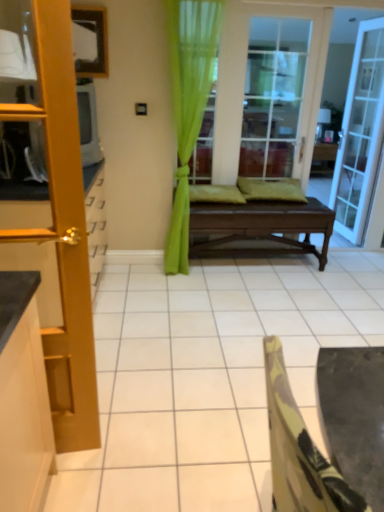
Identify the location of wooden door at left, which is the second door in right-to-left order. (63, 232).

What do you see at coordinates (258, 229) in the screenshot? The image size is (384, 512). I see `dark brown wooden bench at center` at bounding box center [258, 229].

The height and width of the screenshot is (512, 384). In order to click on green sheer curtain at center in this screenshot , I will do `click(188, 105)`.

In the image, there is a clear glass door at center. Where is `chair below it (from a real-world perspective)`? The image size is (384, 512). chair below it (from a real-world perspective) is located at coordinates (299, 451).

Which of these two, camouflage fabric chair at lower right or clear glass door at center, is thinner?

With smaller width is clear glass door at center.

Between camouflage fabric chair at lower right and clear glass door at center, which one has less height?

camouflage fabric chair at lower right is shorter.

I want to click on table located underneath the green sheer curtain at center (from a real-world perspective), so click(258, 229).

Is dark brown wooden bench at center facing away from green sheer curtain at center?

dark brown wooden bench at center is not turned away from green sheer curtain at center.

Could green sheer curtain at center be considered to be inside dark brown wooden bench at center?

No.

From the image's perspective, is dark brown wooden bench at center above or below green sheer curtain at center?

From the image's perspective, dark brown wooden bench at center appears below green sheer curtain at center.

Is clear glass door at center next to camouflage fabric chair at lower right and touching it?

No, clear glass door at center is not with camouflage fabric chair at lower right.

I want to click on glass door that appears behind the camouflage fabric chair at lower right, so click(273, 95).

From the image's perspective, which is above, clear glass door at center or camouflage fabric chair at lower right?

clear glass door at center appears higher in the image.

Looking at this image, can you confirm if dark brown wooden bench at center is taller than camouflage fabric chair at lower right?

No, dark brown wooden bench at center is not taller than camouflage fabric chair at lower right.

Would you say camouflage fabric chair at lower right is part of dark brown wooden bench at center's contents?

Actually, camouflage fabric chair at lower right is outside dark brown wooden bench at center.

Considering the points (218, 248) and (291, 462), which point is in front, point (218, 248) or point (291, 462)?

Point (291, 462)

Identify the location of chair lying in front of the dark brown wooden bench at center. This screenshot has width=384, height=512. point(299,451).

Between point (50, 378) and point (309, 436), which one is positioned in front?

Point (309, 436)

Between wooden door at left, the 1th door in the front-to-back sequence, and camouflage fabric chair at lower right, which one has larger width?

Wider between the two is camouflage fabric chair at lower right.

Could you tell me if wooden door at left, arranged as the second door when viewed from the back, is facing camouflage fabric chair at lower right?

No, wooden door at left, arranged as the second door when viewed from the back, is not turned towards camouflage fabric chair at lower right.

Can you confirm if wooden door at left, the 1th door in the left-to-right sequence, is smaller than camouflage fabric chair at lower right?

Yes, wooden door at left, the 1th door in the left-to-right sequence, is smaller than camouflage fabric chair at lower right.

Measure the distance between clear glass door at center and green sheer curtain at center.

A distance of 32.04 inches exists between clear glass door at center and green sheer curtain at center.

Is clear glass door at center not within green sheer curtain at center?

Indeed, clear glass door at center is completely outside green sheer curtain at center.

Is clear glass door at center not close to green sheer curtain at center?

No, clear glass door at center is not far away from green sheer curtain at center.

Considering the sizes of clear glass door at center and green sheer curtain at center in the image, is clear glass door at center wider or thinner than green sheer curtain at center?

Considering their sizes, clear glass door at center looks slimmer than green sheer curtain at center.

Locate an element on the screen. door located above the dark brown wooden bench at center (from the image's perspective) is located at coordinates (360, 133).

Which object is thinner, clear glass door at upper right, the 2th door from the left, or dark brown wooden bench at center?

Thinner between the two is clear glass door at upper right, the 2th door from the left.

Considering the relative positions of clear glass door at upper right, the 2th door positioned from the front, and dark brown wooden bench at center in the image provided, is clear glass door at upper right, the 2th door positioned from the front, to the left of dark brown wooden bench at center from the viewer's perspective?

In fact, clear glass door at upper right, the 2th door positioned from the front, is to the right of dark brown wooden bench at center.

How much distance is there between clear glass door at upper right, the 2th door from the left, and dark brown wooden bench at center?

clear glass door at upper right, the 2th door from the left, and dark brown wooden bench at center are 1.09 meters apart from each other.

This screenshot has width=384, height=512. What are the coordinates of `chair lying below the clear glass door at center (from the image's perspective)` in the screenshot? It's located at (299, 451).

Locate an element on the screen. This screenshot has width=384, height=512. curtain in front of the dark brown wooden bench at center is located at coordinates (188, 105).

Based on their spatial positions, is camouflage fabric chair at lower right or clear glass door at center further from green sheer curtain at center?

The object further to green sheer curtain at center is camouflage fabric chair at lower right.

Looking at the image, which one is located closer to clear glass door at center, camouflage fabric chair at lower right or wooden door at left, the 1th door in the left-to-right sequence?

wooden door at left, the 1th door in the left-to-right sequence, is closer to clear glass door at center.

When comparing their distances from clear glass door at upper right, marked as the 1th door in a right-to-left arrangement, does wooden door at left, arranged as the second door when viewed from the back, or camouflage fabric chair at lower right seem closer?

wooden door at left, arranged as the second door when viewed from the back, lies closer to clear glass door at upper right, marked as the 1th door in a right-to-left arrangement, than the other object.

When comparing their distances from clear glass door at center, does clear glass door at upper right, the 2th door positioned from the front, or wooden door at left, which is the second door in right-to-left order, seem closer?

clear glass door at upper right, the 2th door positioned from the front, lies closer to clear glass door at center than the other object.

Looking at this image, looking at the image, which one is located further to wooden door at left, arranged as the second door when viewed from the back, camouflage fabric chair at lower right or clear glass door at center?

clear glass door at center is positioned further to the anchor wooden door at left, arranged as the second door when viewed from the back.

When comparing their distances from camouflage fabric chair at lower right, does wooden door at left, the 1th door in the left-to-right sequence, or green sheer curtain at center seem further?

green sheer curtain at center is positioned further to the anchor camouflage fabric chair at lower right.

Which object lies further to the anchor point camouflage fabric chair at lower right, green sheer curtain at center or clear glass door at center?

clear glass door at center lies further to camouflage fabric chair at lower right than the other object.

From the image, which object appears to be nearer to dark brown wooden bench at center, clear glass door at center or green sheer curtain at center?

The object closer to dark brown wooden bench at center is green sheer curtain at center.

The image size is (384, 512). I want to click on glass door situated between green sheer curtain at center and clear glass door at upper right, marked as the 1th door in a right-to-left arrangement, from left to right, so click(273, 95).

This screenshot has height=512, width=384. Find the location of `door positioned between camouflage fabric chair at lower right and green sheer curtain at center from near to far`. door positioned between camouflage fabric chair at lower right and green sheer curtain at center from near to far is located at coordinates (63, 232).

Where is `door positioned between camouflage fabric chair at lower right and clear glass door at center from near to far`? door positioned between camouflage fabric chair at lower right and clear glass door at center from near to far is located at coordinates [63, 232].

At what (x,y) coordinates should I click in order to perform the action: click on curtain between camouflage fabric chair at lower right and clear glass door at center along the z-axis. Please return your answer as a coordinate pair (x, y). This screenshot has height=512, width=384. Looking at the image, I should click on (188, 105).